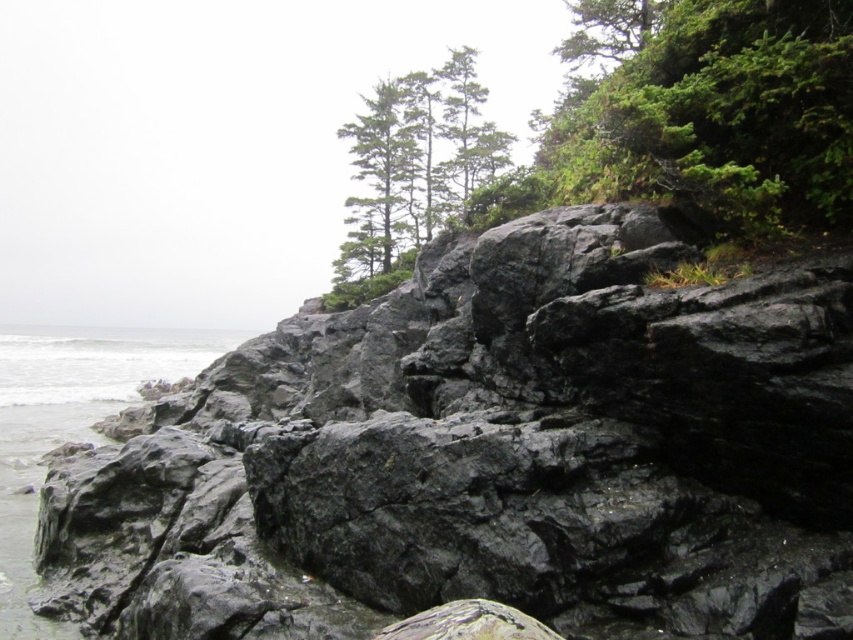
You are standing on the rugged coastal landscape with dark jagged rocks in the foreground. You see a point marked at coordinates (x=712, y=109). What object is located at this point?

The point at coordinates (x=712, y=109) indicates a green leafy tree at upper right.

You are standing at the point marked by point (68, 424) in the coastal landscape. What type of terrain feature is directly beneath your feet?

The point (68, 424) marks gray rock at lower left, so the terrain directly beneath your feet is gray rock.

You are a hiker navigating the coastal path and see the black rough rock at center and the gray rock at lower left. Which rock is positioned higher in the landscape?

The black rough rock at center is positioned higher than the gray rock at lower left because it is located above it.